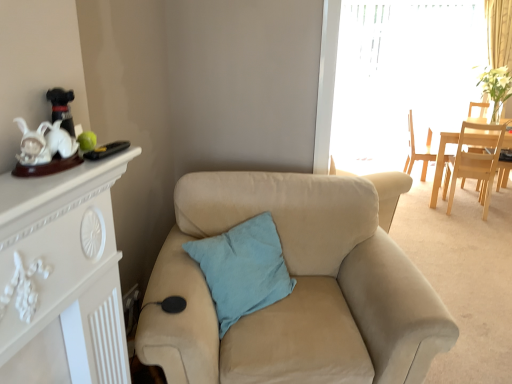
Question: Is beige fabric armchair at center outside of light blue cotton pillow at center?

Choices:
 (A) no
 (B) yes

Answer: (B)

Question: Is there a large distance between beige fabric armchair at center and light blue cotton pillow at center?

Choices:
 (A) yes
 (B) no

Answer: (A)

Question: Does beige fabric armchair at center have a smaller size compared to light blue cotton pillow at center?

Choices:
 (A) yes
 (B) no

Answer: (B)

Question: Is beige fabric armchair at center at the left side of light blue cotton pillow at center?

Choices:
 (A) yes
 (B) no

Answer: (B)

Question: Can you confirm if beige fabric armchair at center is shorter than light blue cotton pillow at center?

Choices:
 (A) no
 (B) yes

Answer: (A)

Question: Based on their sizes in the image, would you say light wood chair at upper right, which is the first chair in back-to-front order, is bigger or smaller than light blue cotton pillow at center?

Choices:
 (A) small
 (B) big

Answer: (B)

Question: Is light wood chair at upper right, which is the first chair in back-to-front order, to the left or to the right of light blue cotton pillow at center in the image?

Choices:
 (A) left
 (B) right

Answer: (B)

Question: Is point (422, 167) positioned closer to the camera than point (228, 304)?

Choices:
 (A) closer
 (B) farther

Answer: (B)

Question: Relative to light blue cotton pillow at center, is light wood chair at upper right, marked as the second chair in a front-to-back arrangement, in front or behind?

Choices:
 (A) front
 (B) behind

Answer: (B)

Question: Is light wood chair at right, which is the first chair from front to back, bigger or smaller than transparent plastic window screen at upper right?

Choices:
 (A) small
 (B) big

Answer: (A)

Question: Based on their positions, is light wood chair at right, which is the first chair from front to back, located to the left or right of transparent plastic window screen at upper right?

Choices:
 (A) left
 (B) right

Answer: (B)

Question: In terms of height, does light wood chair at right, which is the first chair from front to back, look taller or shorter compared to transparent plastic window screen at upper right?

Choices:
 (A) short
 (B) tall

Answer: (A)

Question: Considering their positions, is light wood chair at right, which is the first chair from front to back, located in front of or behind transparent plastic window screen at upper right?

Choices:
 (A) front
 (B) behind

Answer: (A)

Question: Considering the positions of point (445, 44) and point (500, 175), is point (445, 44) closer or farther from the camera than point (500, 175)?

Choices:
 (A) closer
 (B) farther

Answer: (B)

Question: Is transparent plastic window screen at upper right taller or shorter than beige fabric armchair at center?

Choices:
 (A) short
 (B) tall

Answer: (B)